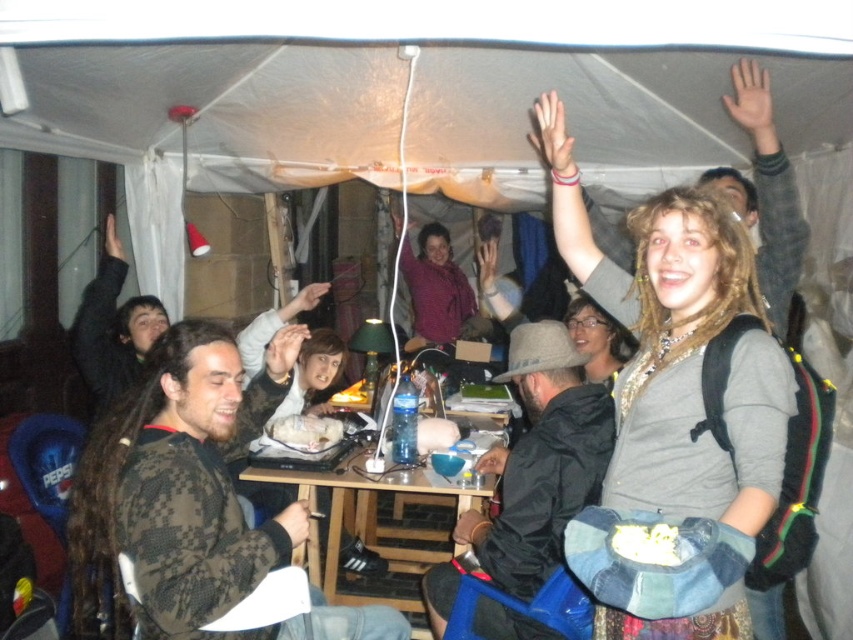
Is smooth skin hand at center smaller than matte black hand at upper left?

Actually, smooth skin hand at center might be larger than matte black hand at upper left.

Is smooth skin hand at center in front of matte black hand at upper left?

No.

Is point (477, 273) positioned after point (112, 218)?

Yes, it is behind point (112, 218).

This screenshot has width=853, height=640. I want to click on smooth skin hand at center, so click(486, 262).

Which is in front, point (444, 323) or point (558, 156)?

Positioned in front is point (558, 156).

In order to click on matte purple shirt at center in this screenshot , I will do `click(434, 289)`.

Which is in front, point (440, 336) or point (567, 170)?

Positioned in front is point (567, 170).

At what (x,y) coordinates should I click in order to perform the action: click on matte purple shirt at center. Please return your answer as a coordinate pair (x, y). The height and width of the screenshot is (640, 853). Looking at the image, I should click on (434, 289).

Is wooden table at center to the left of matte skin hand at center from the viewer's perspective?

No, wooden table at center is not to the left of matte skin hand at center.

Identify the location of wooden table at center. The width and height of the screenshot is (853, 640). (374, 518).